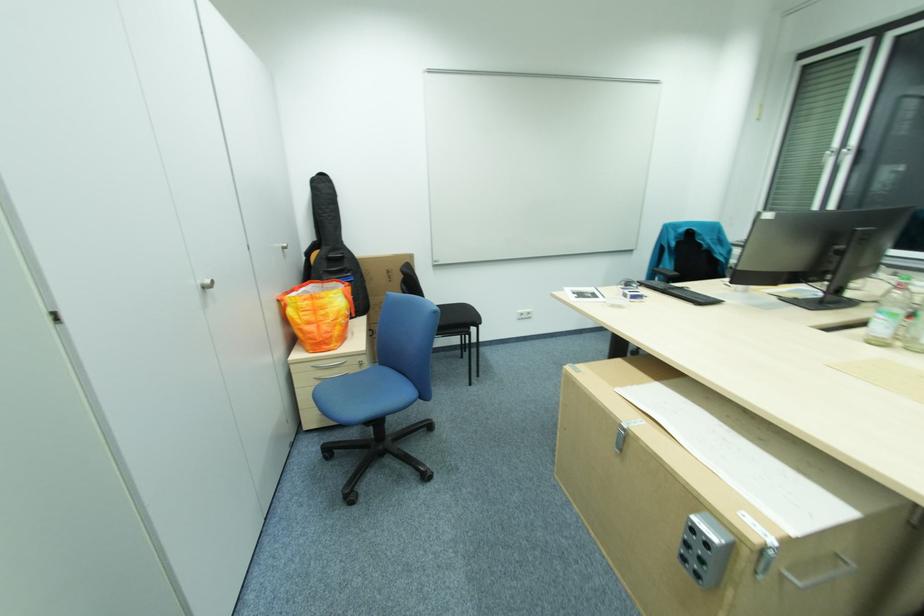
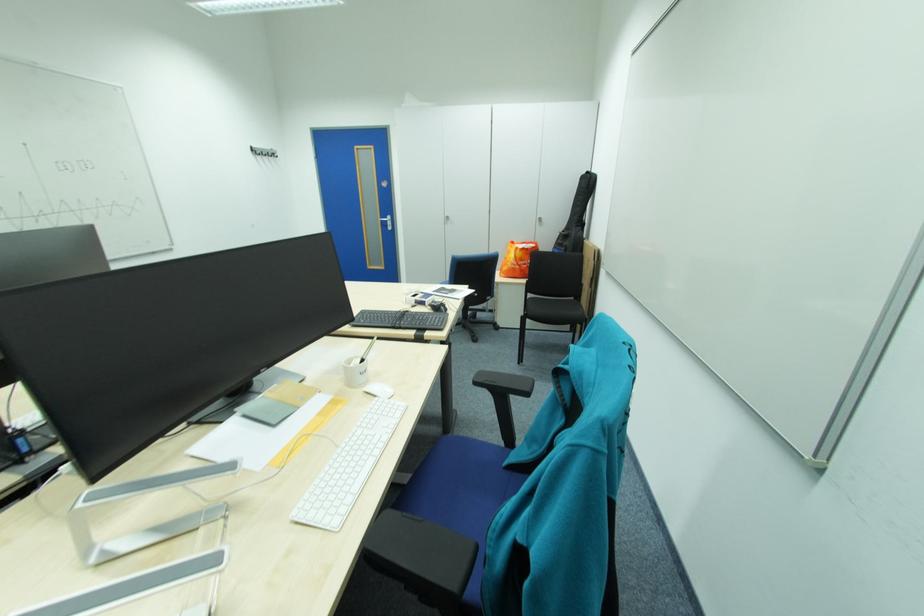
The point at (353, 322) is marked in the first image. Where is the corresponding point in the second image?

(517, 265)